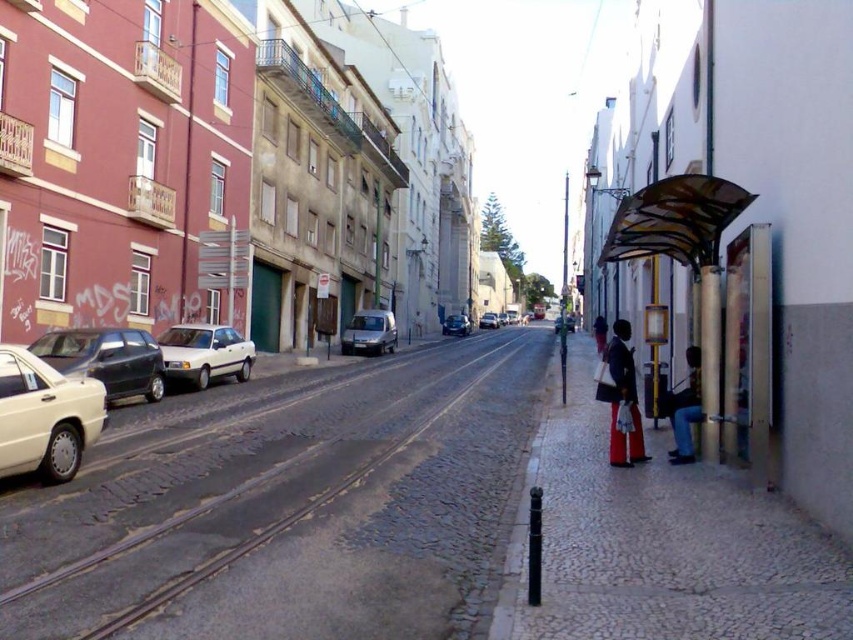
You are a delivery person trying to navigate through the street. You see a matte black jacket at center and a red pants at right. Which one should you avoid stepping on to ensure you have enough space to walk?

The matte black jacket at center occupies less space than red pants at right, so you should avoid stepping on the red pants at right to ensure you have enough space to walk.